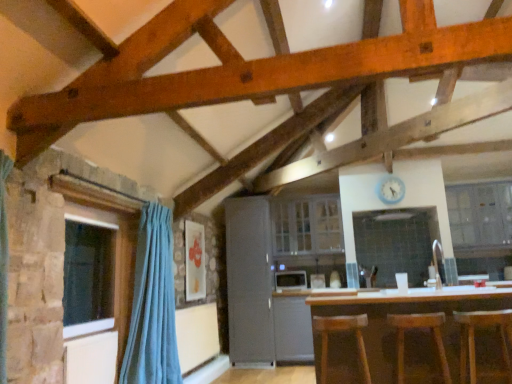
The height and width of the screenshot is (384, 512). Describe the element at coordinates (342, 331) in the screenshot. I see `wooden bar stool at center, the third bar stool from the right` at that location.

What do you see at coordinates (153, 304) in the screenshot? The height and width of the screenshot is (384, 512). I see `teal fabric curtain at left` at bounding box center [153, 304].

Locate an element on the screen. The height and width of the screenshot is (384, 512). white glossy cabinet at center, which is the 2th cabinetry in right-to-left order is located at coordinates (307, 225).

Where is `brown wooden table at center`? This screenshot has width=512, height=384. brown wooden table at center is located at coordinates (409, 313).

Is there a large distance between satin silver microwave at center, which appears as the first appliance when viewed from the left, and white glossy sink at center?

Yes, satin silver microwave at center, which appears as the first appliance when viewed from the left, and white glossy sink at center are located far from each other.

Measure the distance from satin silver microwave at center, which appears as the first appliance when viewed from the left, to white glossy sink at center.

They are 2.28 meters apart.

Is satin silver microwave at center, which is the second appliance from right to left, not inside white glossy sink at center?

Yes, satin silver microwave at center, which is the second appliance from right to left, is located beyond the bounds of white glossy sink at center.

Considering the sizes of objects satin silver microwave at center, which is the second appliance from right to left, and white glossy sink at center in the image provided, who is taller, satin silver microwave at center, which is the second appliance from right to left, or white glossy sink at center?

white glossy sink at center.

Could you measure the distance between metallic silver microwave at center, which is counted as the second appliance, starting from the left, and brown wooden bar stool at lower right, which is the third bar stool in left-to-right order?

8.82 feet.

Would you say metallic silver microwave at center, which is counted as the second appliance, starting from the left, is a long distance from brown wooden bar stool at lower right, which is the third bar stool in left-to-right order?

That's right, there is a large distance between metallic silver microwave at center, which is counted as the second appliance, starting from the left, and brown wooden bar stool at lower right, which is the third bar stool in left-to-right order.

Can you confirm if metallic silver microwave at center, the 1th appliance in the right-to-left sequence, is bigger than brown wooden bar stool at lower right, which is the third bar stool in left-to-right order?

No.

Which of these two, metallic silver microwave at center, which is counted as the second appliance, starting from the left, or brown wooden bar stool at lower right, which is counted as the 1th bar stool, starting from the right, stands shorter?

metallic silver microwave at center, which is counted as the second appliance, starting from the left, is shorter.

Does wooden bar stool at center, the third bar stool from the right, appear on the right side of clear glass window at left?

Yes.

How many degrees apart are the facing directions of wooden bar stool at center, the third bar stool from the right, and clear glass window at left?

91 degrees.

Considering the sizes of objects wooden bar stool at center, placed as the 1th bar stool when sorted from left to right, and clear glass window at left in the image provided, who is smaller, wooden bar stool at center, placed as the 1th bar stool when sorted from left to right, or clear glass window at left?

With smaller size is clear glass window at left.

Between clear glass window at left and wooden bar stool at lower right, the 2th bar stool when ordered from left to right, which one has less height?

wooden bar stool at lower right, the 2th bar stool when ordered from left to right, is shorter.

From a real-world perspective, starting from the clear glass window at left, which bar stool is the 3rd one below it? Please provide its 2D coordinates.

[(419, 328)]

Can you confirm if clear glass window at left is thinner than wooden bar stool at lower right, the 2th bar stool when ordered from left to right?

Correct, the width of clear glass window at left is less than that of wooden bar stool at lower right, the 2th bar stool when ordered from left to right.

There is a teal fabric curtain at left. Where is `the 1st bar stool below it (from a real-world perspective)`? the 1st bar stool below it (from a real-world perspective) is located at coordinates (342, 331).

Are wooden bar stool at center, placed as the 1th bar stool when sorted from left to right, and teal fabric curtain at left located far from each other?

That's right, there is a large distance between wooden bar stool at center, placed as the 1th bar stool when sorted from left to right, and teal fabric curtain at left.

From a real-world perspective, is wooden bar stool at center, the third bar stool from the right, on top of teal fabric curtain at left?

No, from a real-world perspective, wooden bar stool at center, the third bar stool from the right, is not above teal fabric curtain at left.

In the scene shown: How much distance is there between wooden bar stool at center, the third bar stool from the right, and teal fabric curtain at left?

The distance of wooden bar stool at center, the third bar stool from the right, from teal fabric curtain at left is 1.48 meters.

From the image's perspective, is brown wooden table at center on top of satin silver microwave at center, which is the second appliance from right to left?

Yes, from the image's perspective, brown wooden table at center is above satin silver microwave at center, which is the second appliance from right to left.

Is brown wooden table at center bigger or smaller than satin silver microwave at center, which is the second appliance from right to left?

brown wooden table at center is bigger than satin silver microwave at center, which is the second appliance from right to left.

Between brown wooden table at center and satin silver microwave at center, which is the second appliance from right to left, which one appears on the right side from the viewer's perspective?

brown wooden table at center is more to the right.

From the image's perspective, between clear glass window at left and satin grey refrigerator at center, which one is located above?

clear glass window at left, from the image's perspective.

Can we say clear glass window at left lies outside satin grey refrigerator at center?

Indeed, clear glass window at left is completely outside satin grey refrigerator at center.

Is satin grey refrigerator at center at the back of clear glass window at left?

No, clear glass window at left is not facing the opposite direction of satin grey refrigerator at center.

Where is `the 1st appliance located beneath the white glossy sink at center (from a real-world perspective)`? the 1st appliance located beneath the white glossy sink at center (from a real-world perspective) is located at coordinates (290, 280).

Identify the location of appliance that is the 1st object above the brown wooden bar stool at lower right, which is counted as the 1th bar stool, starting from the right (from a real-world perspective). (317, 281).

Estimate the real-world distances between objects in this image. Which object is closer to satin grey refrigerator at center, wooden bar stool at center, the third bar stool from the right, or wooden bar stool at lower right, the 2th bar stool when ordered from left to right?

Among the two, wooden bar stool at center, the third bar stool from the right, is located nearer to satin grey refrigerator at center.

When comparing their distances from brown wooden table at center, does metallic silver microwave at center, the 1th appliance in the right-to-left sequence, or white glossy sink at center seem closer?

white glossy sink at center.

Which object lies nearer to the anchor point wooden bar stool at lower right, arranged as the 2th bar stool when viewed from the right, wooden bar stool at center, the third bar stool from the right, or satin grey refrigerator at center?

wooden bar stool at center, the third bar stool from the right, is closer to wooden bar stool at lower right, arranged as the 2th bar stool when viewed from the right.

From the image, which object appears to be nearer to satin grey refrigerator at center, wooden bar stool at lower right, the 2th bar stool when ordered from left to right, or satin silver microwave at center, which appears as the first appliance when viewed from the left?

satin silver microwave at center, which appears as the first appliance when viewed from the left.

Based on the photo, based on their spatial positions, is metallic silver microwave at center, the 1th appliance in the right-to-left sequence, or teal fabric curtain at left further from satin silver microwave at center, which is the second appliance from right to left?

Among the two, teal fabric curtain at left is located further to satin silver microwave at center, which is the second appliance from right to left.

Estimate the real-world distances between objects in this image. Which object is closer to white glossy cabinet at upper center, marked as the 1th cabinetry in a right-to-left arrangement, white glossy sink at center or brown wooden bar stool at lower right, which is the third bar stool in left-to-right order?

white glossy sink at center is positioned closer to the anchor white glossy cabinet at upper center, marked as the 1th cabinetry in a right-to-left arrangement.

When comparing their distances from wooden bar stool at lower right, arranged as the 2th bar stool when viewed from the right, does white glossy cabinet at center, which is the first cabinetry in left-to-right order, or white glossy sink at center seem further?

Among the two, white glossy cabinet at center, which is the first cabinetry in left-to-right order, is located further to wooden bar stool at lower right, arranged as the 2th bar stool when viewed from the right.

Which object lies further to the anchor point satin grey refrigerator at center, brown wooden bar stool at lower right, which is counted as the 1th bar stool, starting from the right, or metallic silver microwave at center, which is counted as the second appliance, starting from the left?

brown wooden bar stool at lower right, which is counted as the 1th bar stool, starting from the right, is positioned further to the anchor satin grey refrigerator at center.

Locate an element on the screen. table situated between teal fabric curtain at left and white glossy cabinet at upper center, marked as the 1th cabinetry in a right-to-left arrangement, from left to right is located at coordinates 409,313.

Find the location of `sink between clear glass window at left and metallic silver microwave at center, which is counted as the second appliance, starting from the left, from front to back`. sink between clear glass window at left and metallic silver microwave at center, which is counted as the second appliance, starting from the left, from front to back is located at coordinates (441, 268).

The height and width of the screenshot is (384, 512). I want to click on window located between wooden bar stool at lower right, the 2th bar stool when ordered from left to right, and white glossy cabinet at center, which is the 2th cabinetry in right-to-left order, in the depth direction, so click(x=115, y=252).

Locate an element on the screen. The width and height of the screenshot is (512, 384). sink between brown wooden bar stool at lower right, which is counted as the 1th bar stool, starting from the right, and satin silver microwave at center, which is the second appliance from right to left, along the z-axis is located at coordinates (441, 268).